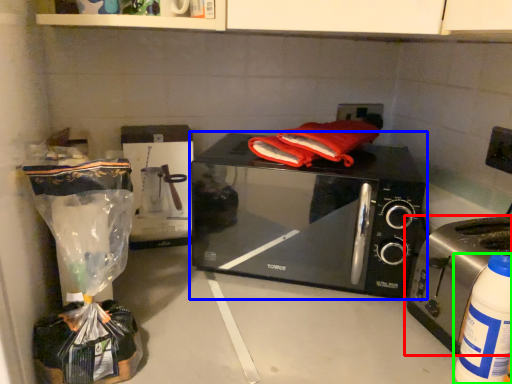
Question: Which object is positioned closest to toaster (highlighted by a red box)? Select from microwave oven (highlighted by a blue box) and bottle (highlighted by a green box).

Choices:
 (A) microwave oven
 (B) bottle

Answer: (B)